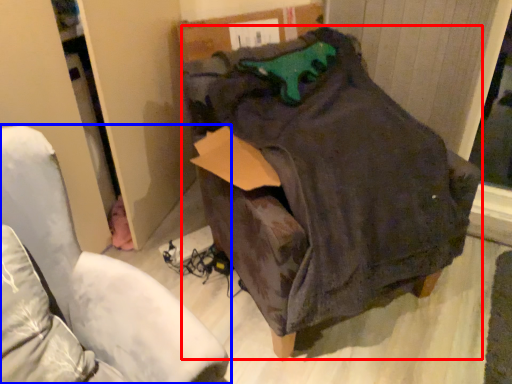
Question: Which object is closer to the camera taking this photo, bean bag chair (highlighted by a red box) or furniture (highlighted by a blue box)?

Choices:
 (A) bean bag chair
 (B) furniture

Answer: (B)